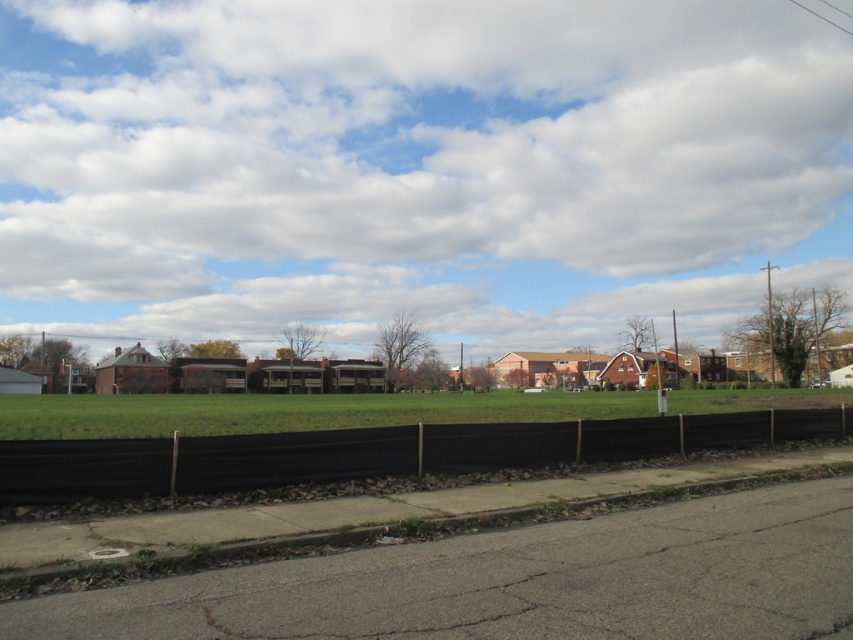
You are a delivery person trying to park your van on the road. You notice the black plastic fence at lower center and the gray concrete curb at lower center. Which object is closer to the road?

The gray concrete curb at lower center is closer to the road because the black plastic fence at lower center is positioned on its right side, placing it further away from the road.

You are a bird flying over the suburban scene. You notice the white fluffy cloud at upper center and the gray concrete curb at lower center. Which object is higher in the sky?

The white fluffy cloud at upper center is much taller than the gray concrete curb at lower center, so the cloud is higher in the sky.

You are a drone operator who needs to fly a drone from the black plastic fence at lower center to the white fluffy cloud at upper center. Given that the drone has a maximum flight range of 600 feet, will it be able to reach the cloud without recharging?

The distance between the white fluffy cloud at upper center and the black plastic fence at lower center is 594.00 feet, which is within the drone operator s 600 feet maximum flight range. Therefore, the drone can reach the white fluffy cloud at upper center without needing to recharge.